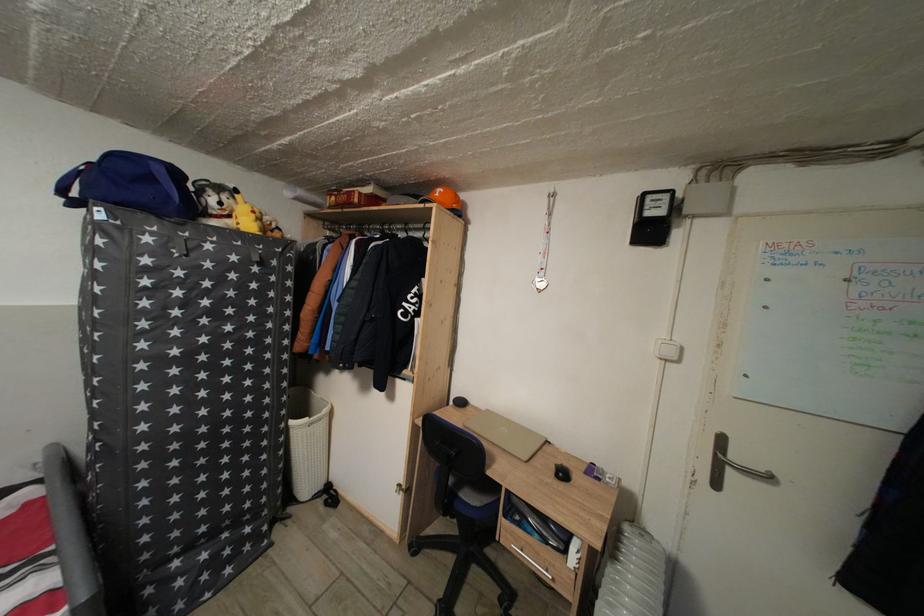
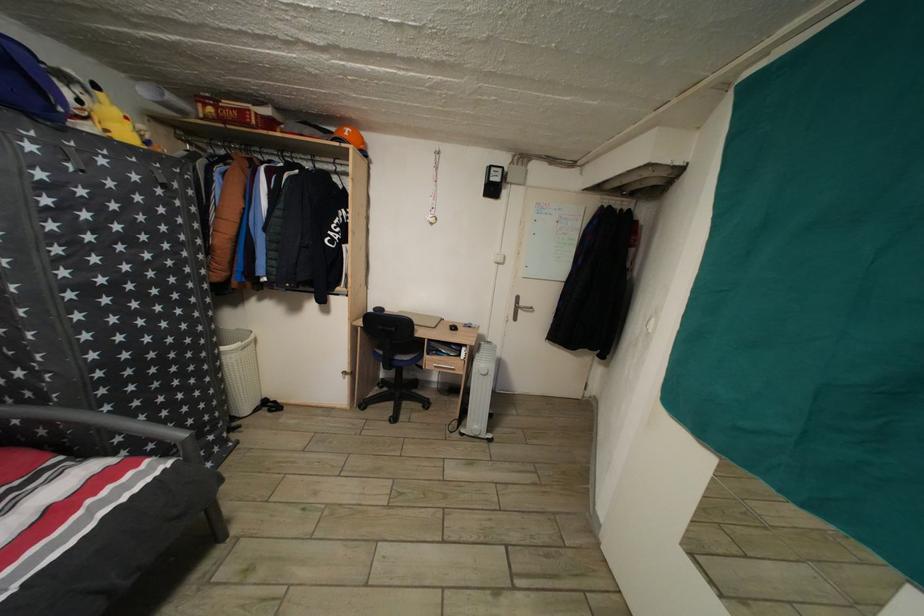
In the second image, find the point that corresponds to point (742, 463) in the first image.

(529, 310)